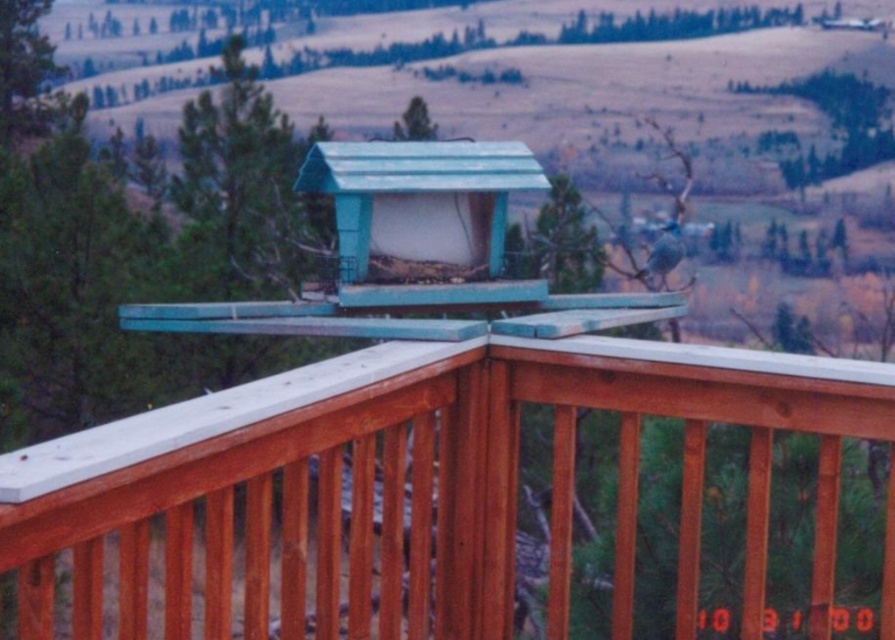
Can you confirm if wooden porch at center is taller than teal plastic bird feeder at center?

Indeed, wooden porch at center has a greater height compared to teal plastic bird feeder at center.

Is point (759, 365) positioned before point (416, 184)?

Yes.

Between point (479, 364) and point (380, 220), which one is positioned in front?

Point (479, 364)

Identify the location of wooden porch at center. (423, 483).